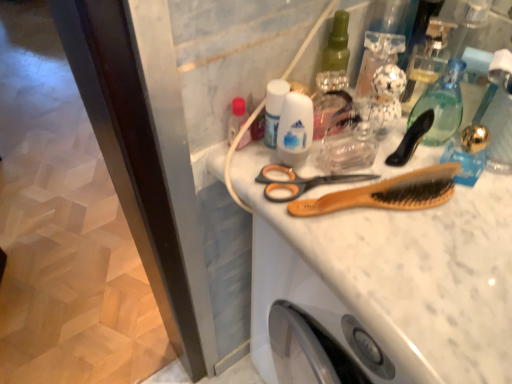
Locate an element on the screen. This screenshot has width=512, height=384. free space in front of wooden comb at center is located at coordinates (403, 283).